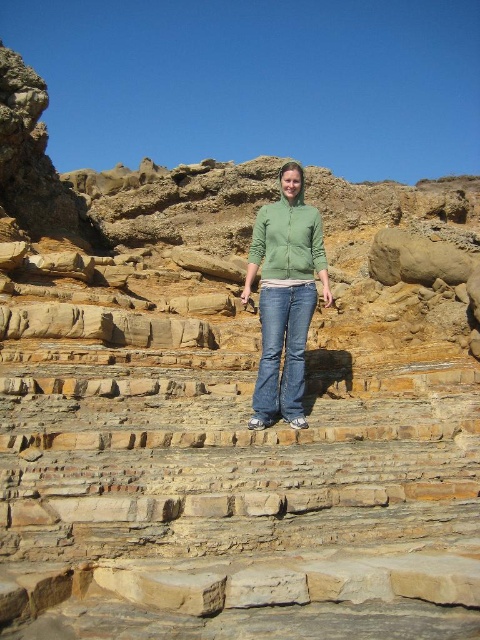
Question: From the image, what is the correct spatial relationship of green matte hoodie at center in relation to blue denim jeans at center?

Choices:
 (A) right
 (B) left

Answer: (B)

Question: Which point is closer to the camera taking this photo?

Choices:
 (A) (301, 374)
 (B) (300, 422)

Answer: (B)

Question: Does green matte hoodie at center appear on the right side of blue denim jeans at center?

Choices:
 (A) yes
 (B) no

Answer: (B)

Question: Does green matte hoodie at center have a larger size compared to blue denim jeans at center?

Choices:
 (A) no
 (B) yes

Answer: (B)